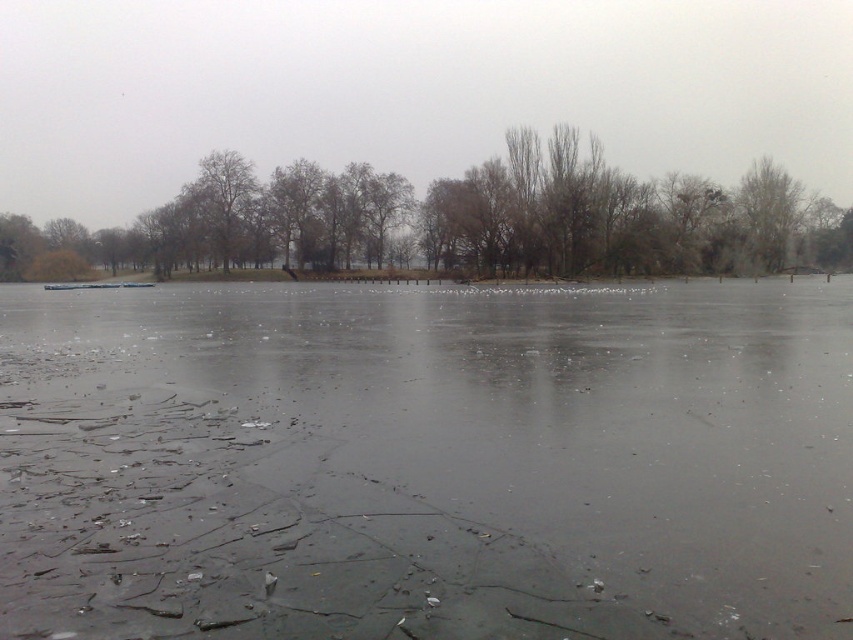
In the scene shown: You are an artist sketching the winter landscape and want to capture the contrast between the brown leafless trees at upper center and the bare branches at upper right. Which of these two objects has a greater width in the image?

The brown leafless trees at upper center has a greater width than the bare branches at upper right according to the description.

You are an ice skater planning to glide across the frozen lake. You notice the transparent ice at center and the bare branches at upper right. Which area would provide a safer path for skating, and why?

The transparent ice at center is safer for skating because it is wider than the bare branches at upper right, indicating it might be thicker and more stable.

You are an artist preparing to paint this winter scene. You want to ensure the brown leafless trees at upper center and the bare branches at upper right are proportionally accurate. Which of these two objects should you draw larger in your painting?

The brown leafless trees at upper center should be drawn larger because they are bigger than the bare branches at upper right according to the description.